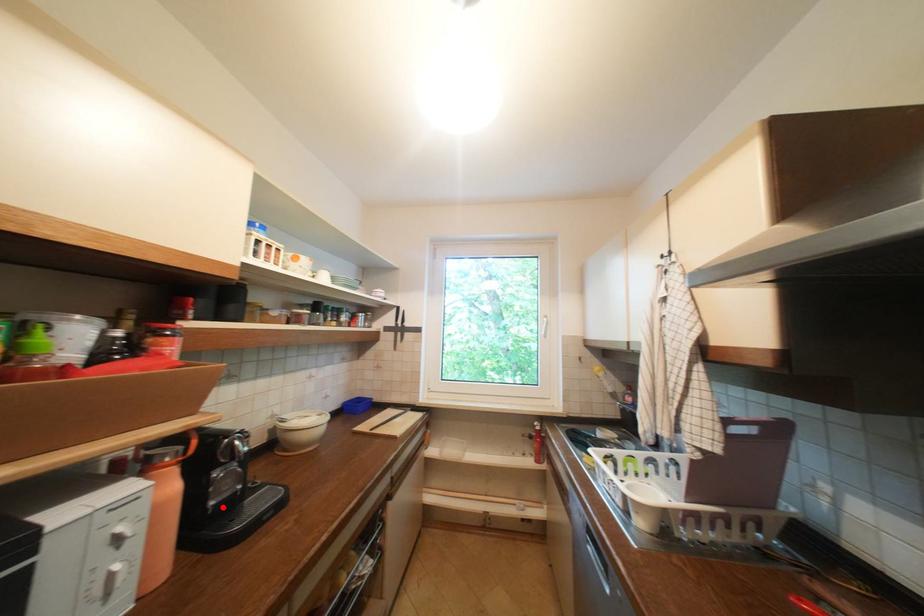
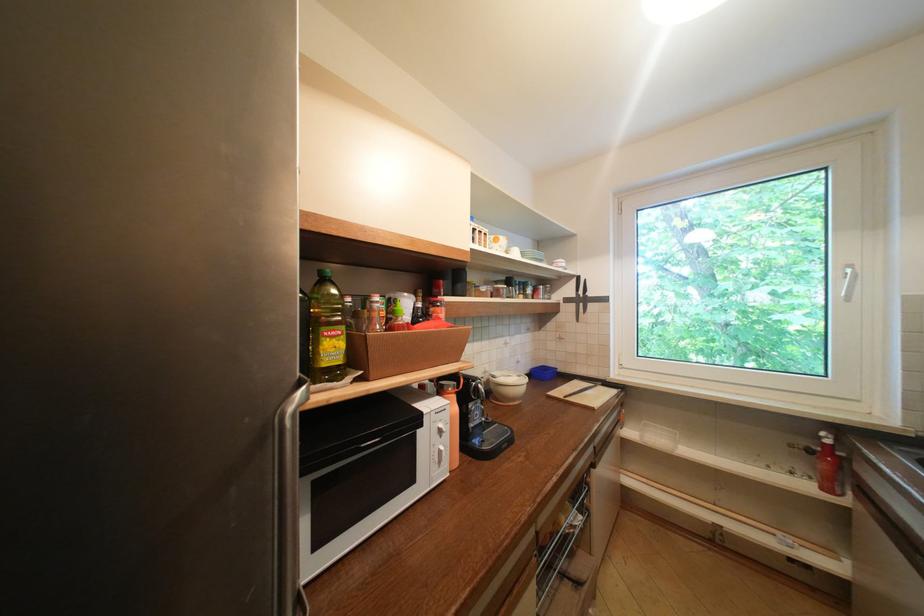
The point at the highlighted location is marked in the first image. Where is the corresponding point in the second image?

(481, 429)